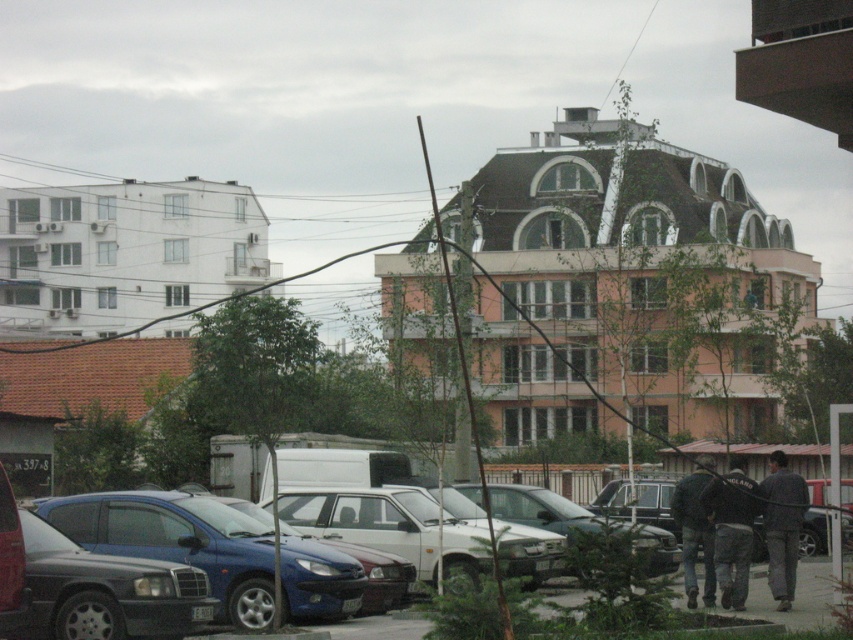
Question: Which is nearer to the gray cotton pants at lower right?

Choices:
 (A) jeans at lower right
 (B) dark blue jeans at lower right

Answer: (B)

Question: Can you confirm if dark blue jeans at lower right is positioned above jeans at lower right?

Choices:
 (A) yes
 (B) no

Answer: (B)

Question: Which object appears farthest from the camera in this image?

Choices:
 (A) dark blue jeans at lower right
 (B) jeans at lower right

Answer: (B)

Question: Where is gray cotton pants at lower right located in relation to jeans at lower right in the image?

Choices:
 (A) below
 (B) above

Answer: (B)

Question: Which object is closer to the camera taking this photo?

Choices:
 (A) gray cotton pants at lower right
 (B) jeans at lower right
 (C) dark blue jeans at lower right

Answer: (C)

Question: Is dark blue jeans at lower right thinner than jeans at lower right?

Choices:
 (A) no
 (B) yes

Answer: (A)